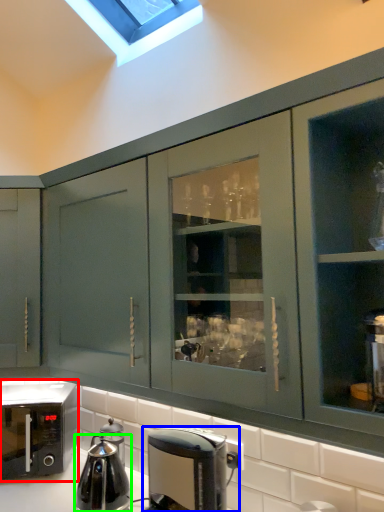
Question: Considering the real-world distances, which object is closest to home appliance (highlighted by a red box)? coffee maker (highlighted by a blue box) or kitchen appliance (highlighted by a green box).

Choices:
 (A) coffee maker
 (B) kitchen appliance

Answer: (B)